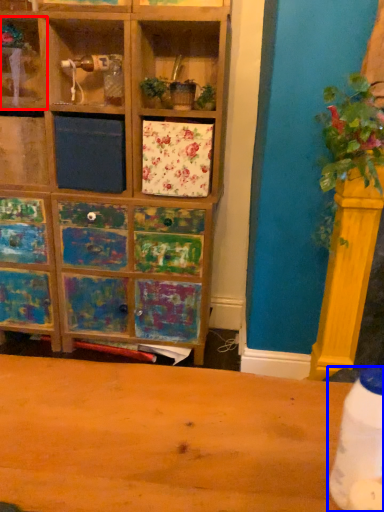
Question: Which object appears closest to the camera in this image, shelf (highlighted by a red box) or bottle (highlighted by a blue box)?

Choices:
 (A) shelf
 (B) bottle

Answer: (B)